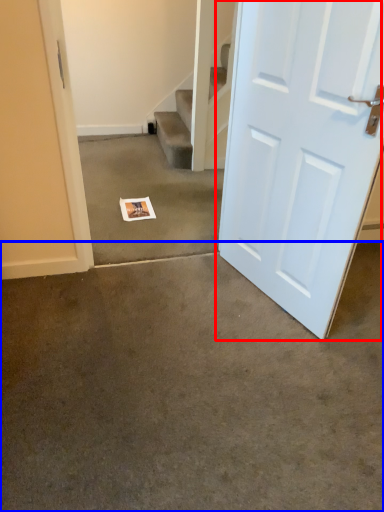
Question: Which object appears farthest to the camera in this image, door (highlighted by a red box) or concrete (highlighted by a blue box)?

Choices:
 (A) door
 (B) concrete

Answer: (A)